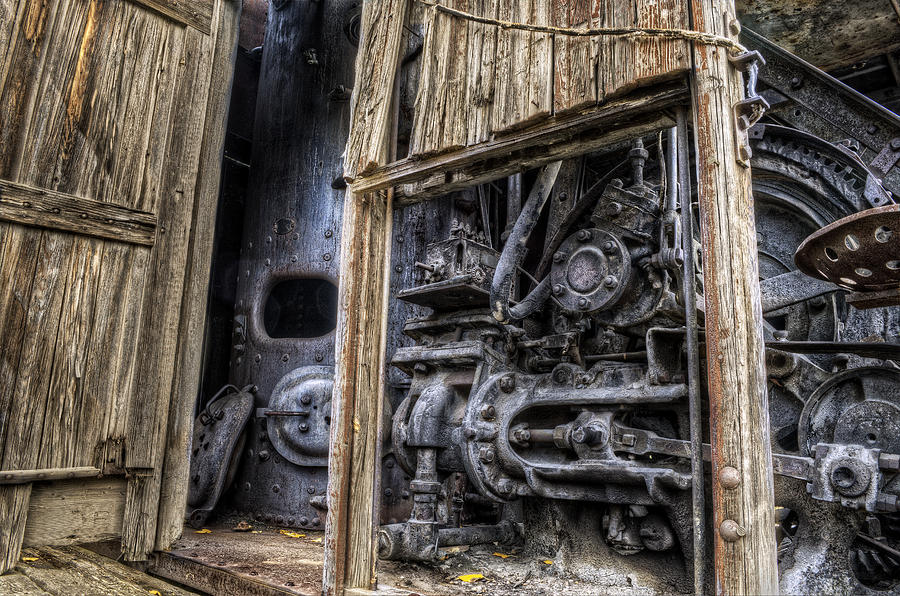
The image size is (900, 596). I want to click on wooden floor, so click(x=122, y=572).